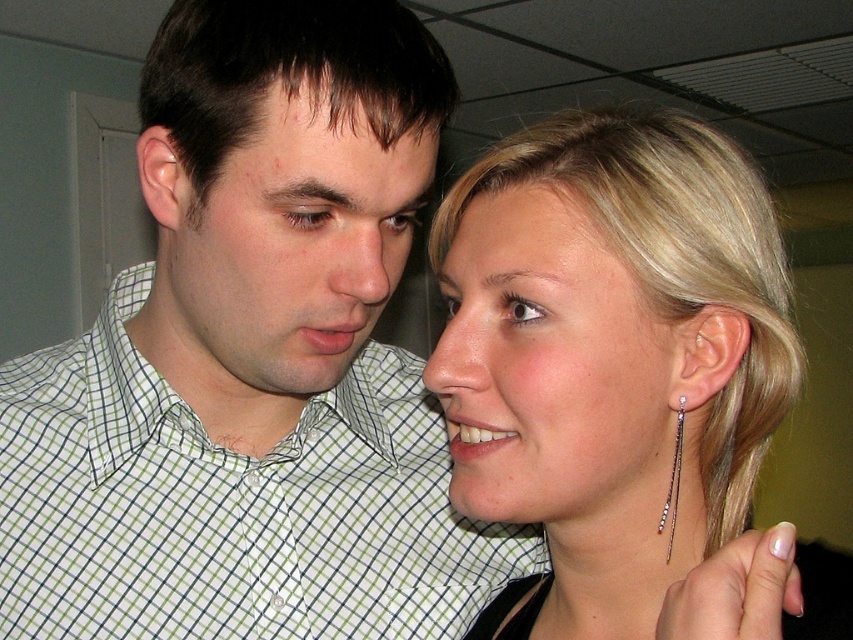
Does sleek silver earrings at upper right have a smaller size compared to pale skin at center?

Actually, sleek silver earrings at upper right might be larger than pale skin at center.

Which of these two, sleek silver earrings at upper right or pale skin at center, stands taller?

sleek silver earrings at upper right is taller.

Between point (618, 154) and point (556, 353), which one is positioned behind?

Point (618, 154)

The width and height of the screenshot is (853, 640). I want to click on sleek silver earrings at upper right, so click(611, 353).

Which is behind, point (646, 339) or point (352, 125)?

The point (352, 125) is behind.

Find the location of `pale skin at center`. pale skin at center is located at coordinates (550, 371).

The width and height of the screenshot is (853, 640). What are the coordinates of `pale skin at center` in the screenshot? It's located at (550, 371).

Which is below, pale skin at center or matte green checkered shirt at center?

pale skin at center is lower down.

Is point (641, 481) less distant than point (257, 244)?

Yes, it is in front of point (257, 244).

Where is `pale skin at center`? Image resolution: width=853 pixels, height=640 pixels. pale skin at center is located at coordinates (550, 371).